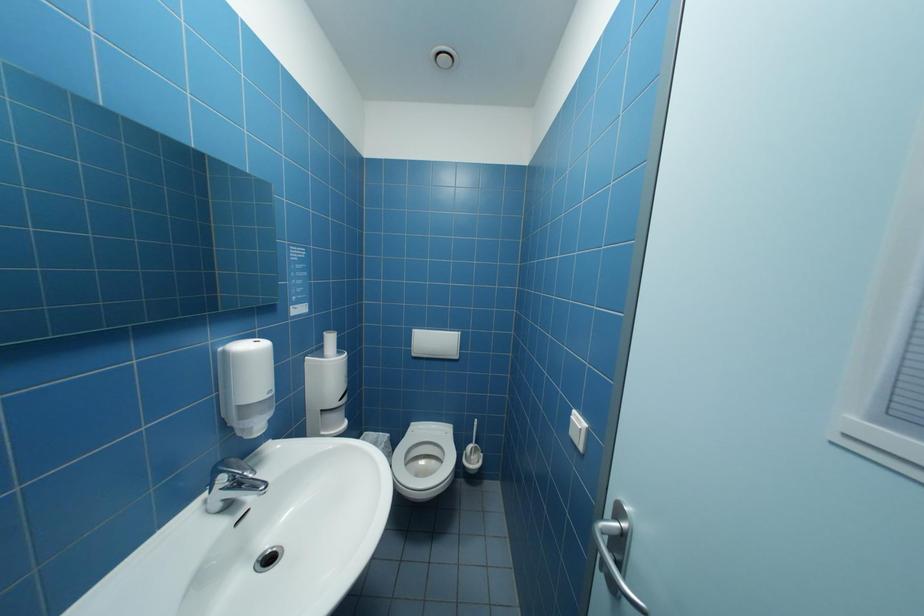
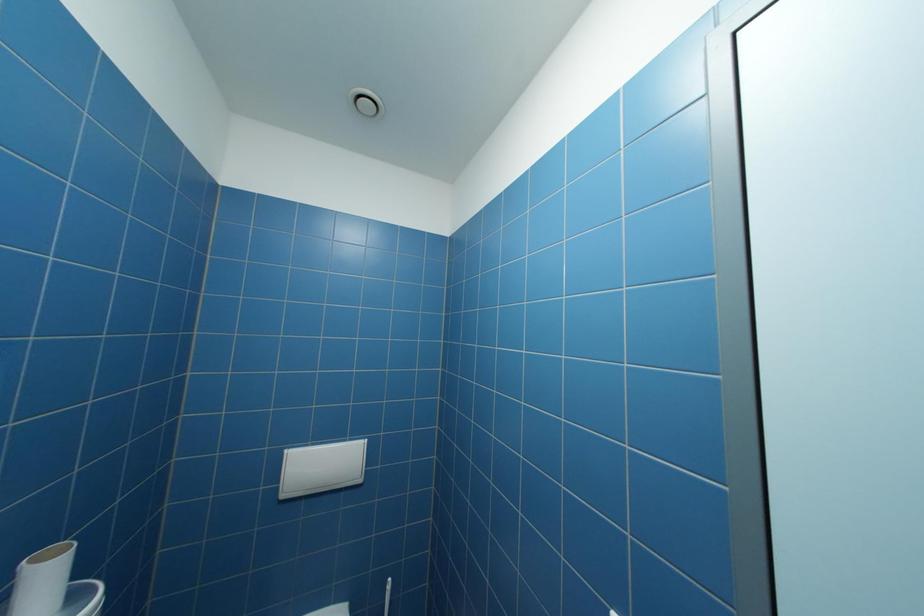
Question: The camera is either moving clockwise (left) or counter-clockwise (right) around the object. The first image is from the beginning of the video and the second image is from the end. Is the camera moving left or right when shooting the video?

Choices:
 (A) Left
 (B) Right

Answer: (A)